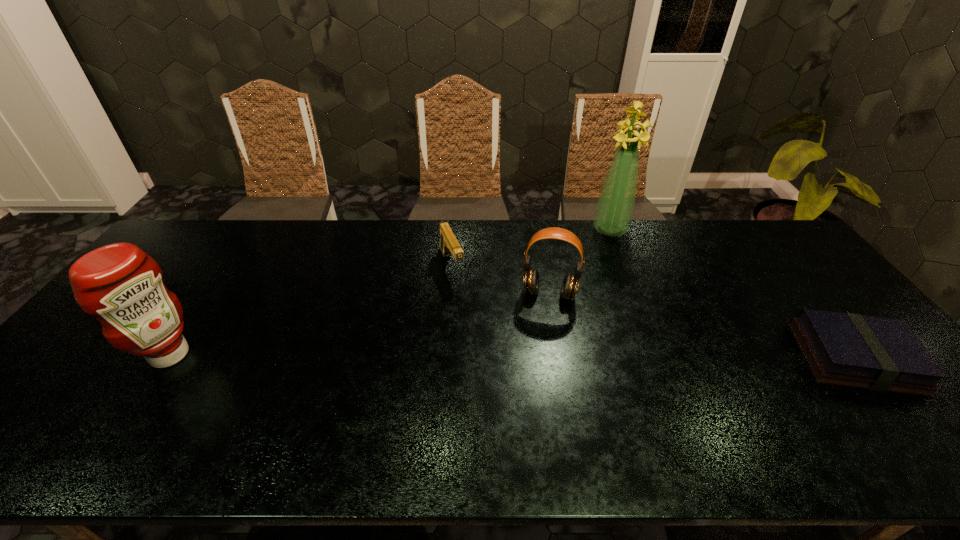
I want to click on free space on the desktop that is between the leftmost object and the rightmost object and is positioned on the front-facing side of the farthest object, so click(566, 356).

I want to click on vacant space on the desktop that is between the fourth shortest object and the rightmost object and is positioned at the barrel of the pistol, so click(497, 356).

At what (x,y) coordinates should I click in order to perform the action: click on free spot on the desktop that is between the condiment and the shortest object and is positioned on the ear cups of the headset. Please return your answer as a coordinate pair (x, y). The width and height of the screenshot is (960, 540). Looking at the image, I should click on (540, 356).